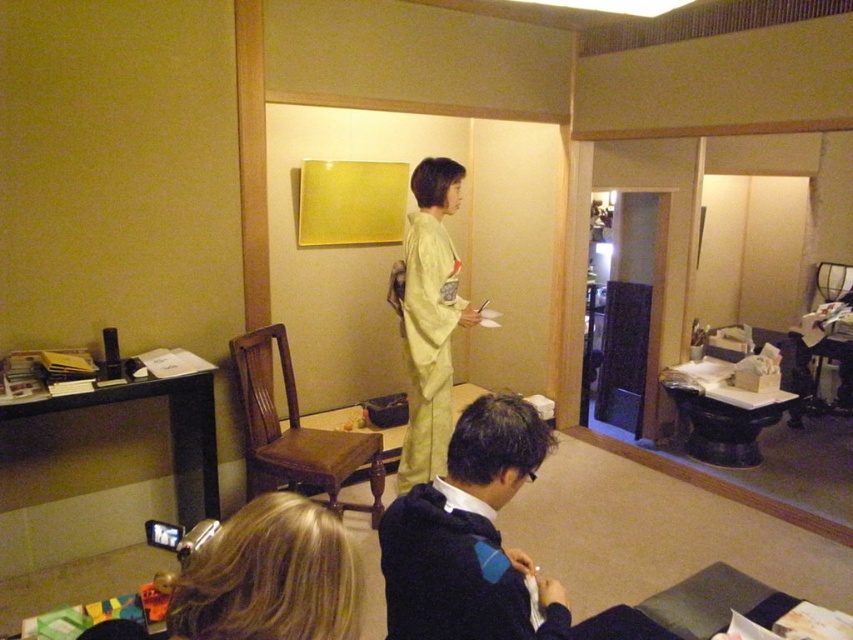
Question: Which is farther from the light yellow silk kimono at center?

Choices:
 (A) dark blue sweater at lower center
 (B) blonde hair at lower center

Answer: (B)

Question: Which object is farther from the camera taking this photo?

Choices:
 (A) blonde hair at lower center
 (B) dark blue sweater at lower center

Answer: (B)

Question: Where is blonde hair at lower center located in relation to light yellow silk kimono at center in the image?

Choices:
 (A) left
 (B) right

Answer: (A)

Question: Is blonde hair at lower center to the left of light yellow silk kimono at center from the viewer's perspective?

Choices:
 (A) no
 (B) yes

Answer: (B)

Question: Which object is the farthest from the blonde hair at lower center?

Choices:
 (A) light yellow silk kimono at center
 (B) dark blue sweater at lower center

Answer: (A)

Question: In this image, where is dark blue sweater at lower center located relative to blonde hair at lower center?

Choices:
 (A) right
 (B) left

Answer: (A)